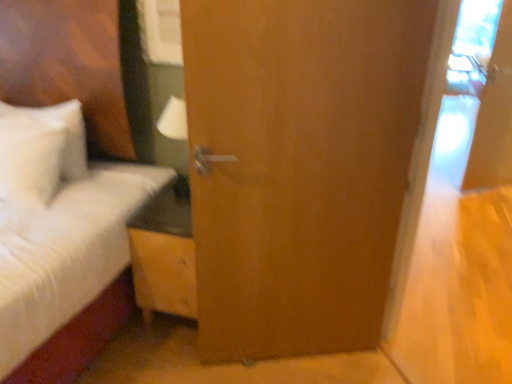
Question: Could you tell me if white fluffy bed at left is turned towards wooden nightstand at center?

Choices:
 (A) no
 (B) yes

Answer: (A)

Question: Is white fluffy bed at left bigger than wooden nightstand at center?

Choices:
 (A) no
 (B) yes

Answer: (B)

Question: Considering the relative sizes of white fluffy bed at left and wooden nightstand at center in the image provided, is white fluffy bed at left taller than wooden nightstand at center?

Choices:
 (A) no
 (B) yes

Answer: (B)

Question: From a real-world perspective, does white fluffy bed at left stand above wooden nightstand at center?

Choices:
 (A) yes
 (B) no

Answer: (A)

Question: Is white fluffy bed at left wider than wooden nightstand at center?

Choices:
 (A) no
 (B) yes

Answer: (B)

Question: Does white fluffy bed at left lie in front of wooden nightstand at center?

Choices:
 (A) yes
 (B) no

Answer: (A)

Question: Is wooden door at center not inside wooden nightstand at center?

Choices:
 (A) no
 (B) yes

Answer: (B)

Question: Is wooden door at center at the left side of wooden nightstand at center?

Choices:
 (A) yes
 (B) no

Answer: (B)

Question: Could you tell me if wooden door at center is facing wooden nightstand at center?

Choices:
 (A) no
 (B) yes

Answer: (A)

Question: Would you say wooden nightstand at center is part of wooden door at center's contents?

Choices:
 (A) no
 (B) yes

Answer: (A)

Question: From a real-world perspective, is wooden door at center positioned under wooden nightstand at center based on gravity?

Choices:
 (A) yes
 (B) no

Answer: (B)

Question: Is wooden door at center thinner than wooden nightstand at center?

Choices:
 (A) no
 (B) yes

Answer: (B)

Question: Is wooden nightstand at center wider than wooden door at center?

Choices:
 (A) yes
 (B) no

Answer: (A)